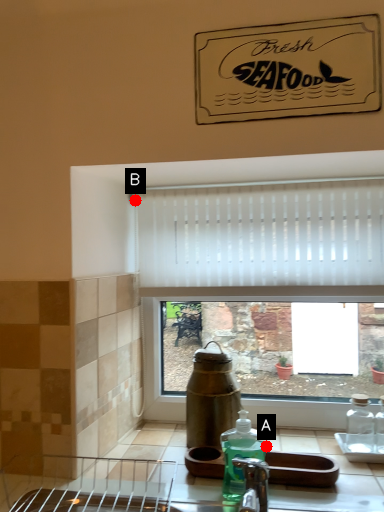
Question: Two points are circled on the image, labeled by A and B beside each circle. Which point is farther to the camera?

Choices:
 (A) A is further
 (B) B is further

Answer: (B)